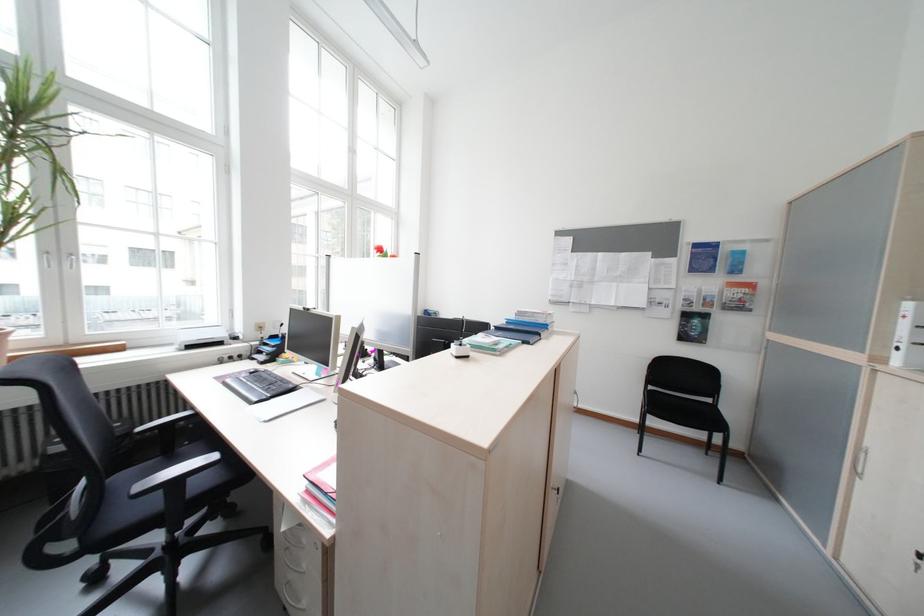
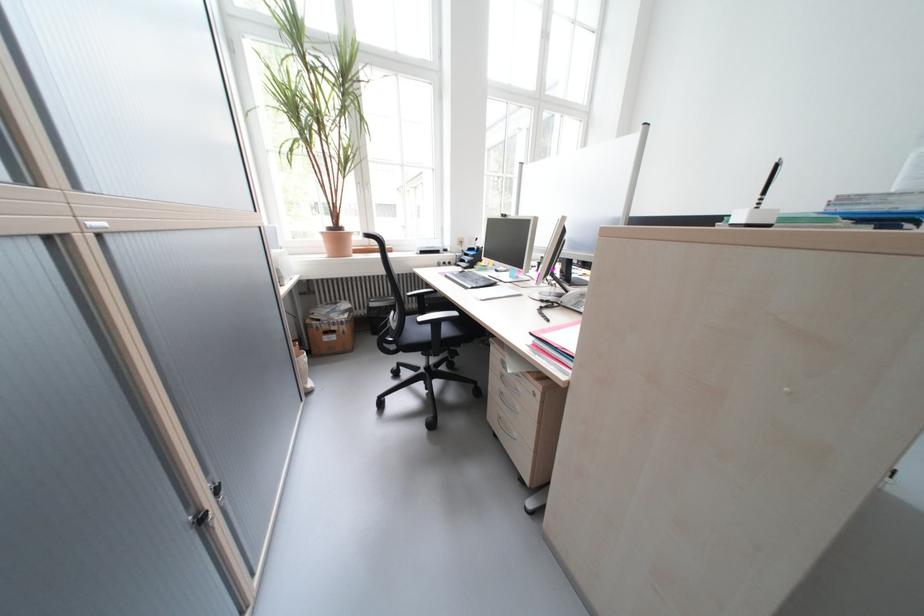
Find the pixel in the second image that matches [150,431] in the first image.

(419, 294)